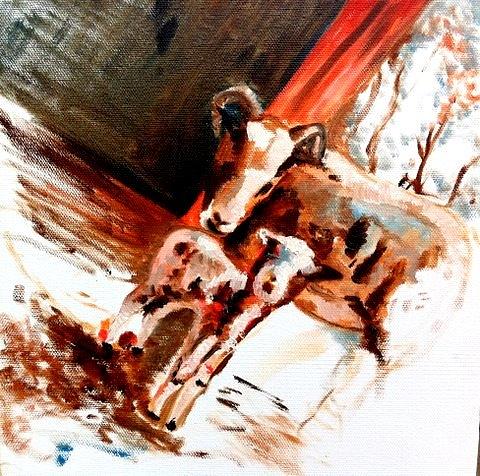
The image size is (480, 476). Find the location of `floor`. floor is located at coordinates (84, 209).